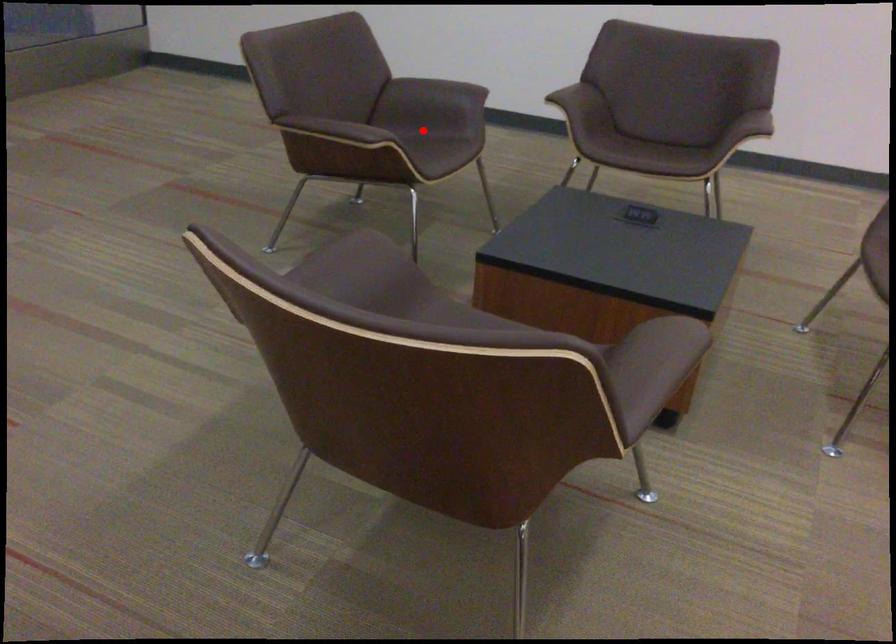
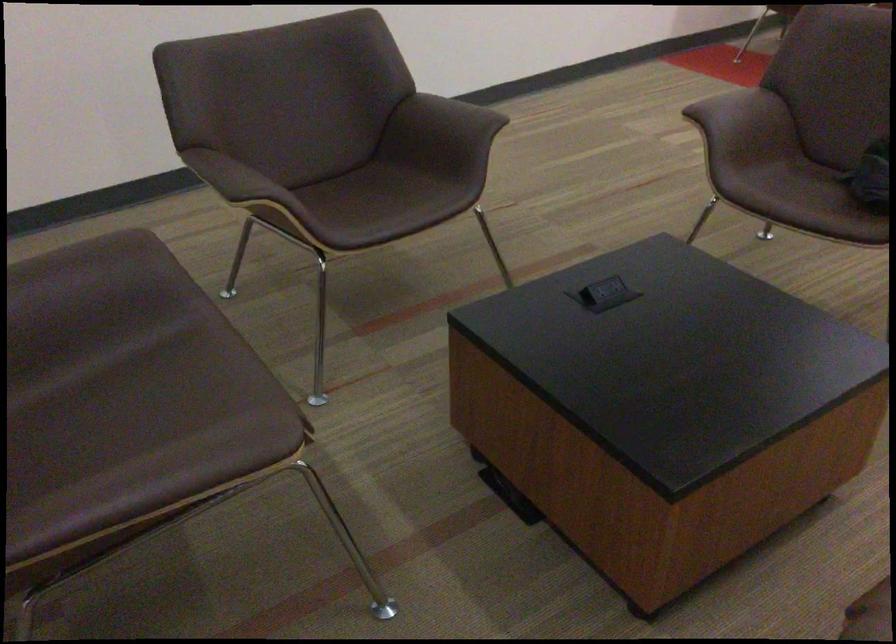
Find the pixel in the second image that matches the highlighted location in the first image.

(80, 364)